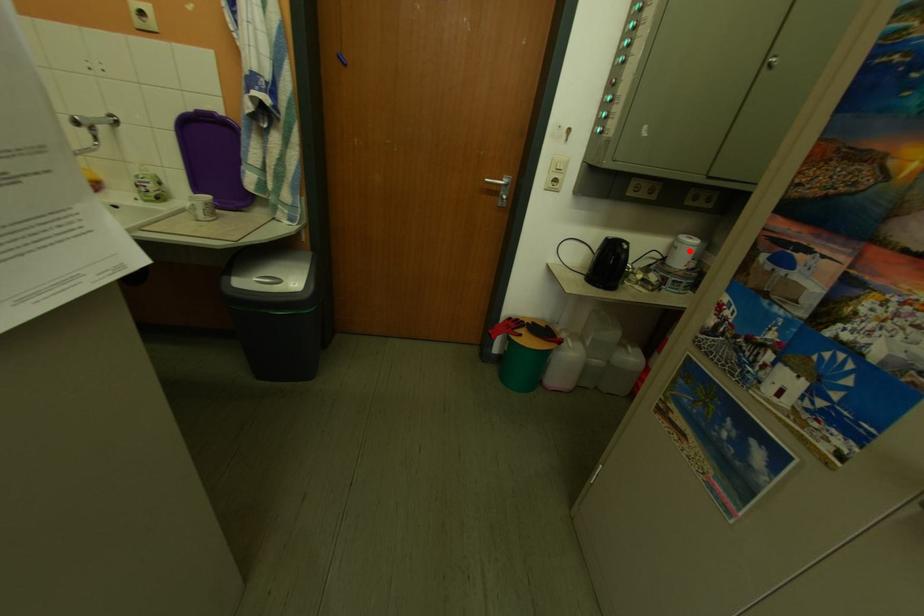
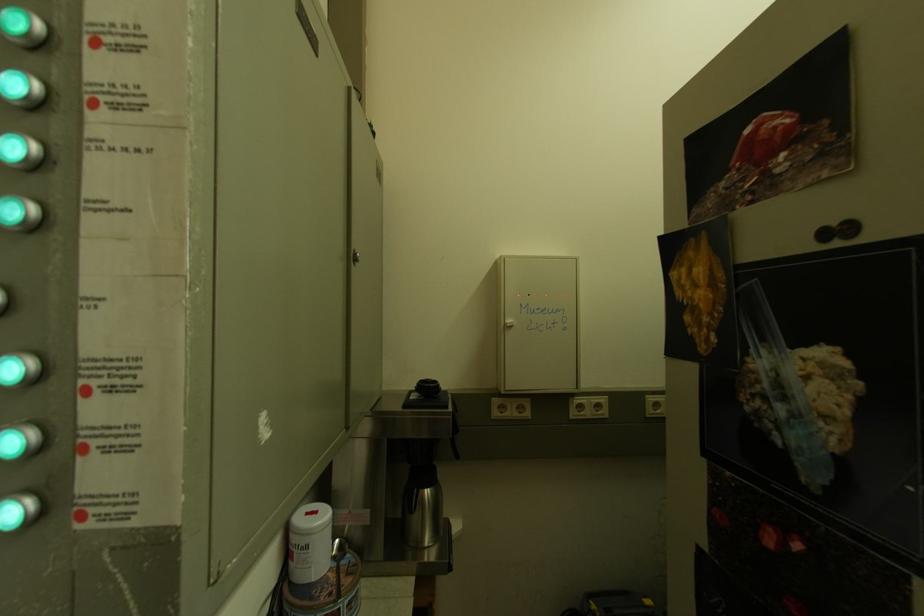
The point at the highlighted location is marked in the first image. Where is the corresponding point in the second image?

(320, 551)